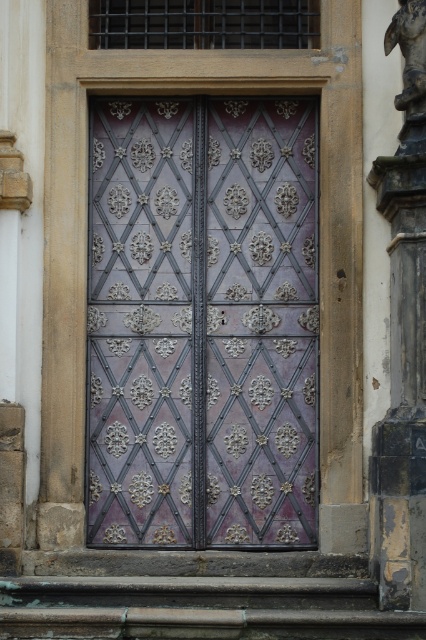
Can you confirm if purple metallic door at center is bigger than dark gray stone pillar at right?

Correct, purple metallic door at center is larger in size than dark gray stone pillar at right.

The width and height of the screenshot is (426, 640). What are the coordinates of `purple metallic door at center` in the screenshot? It's located at (203, 323).